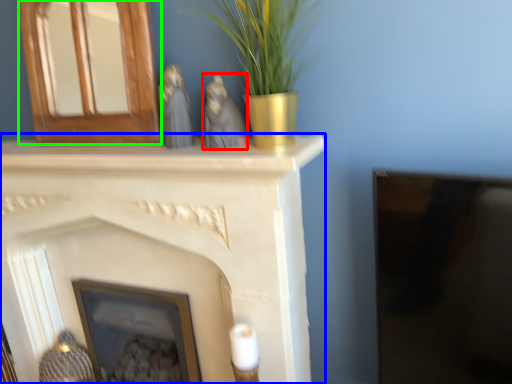
Question: Which object is positioned closest to animal (highlighted by a red box)? Select from fireplace (highlighted by a blue box) and fireplace (highlighted by a green box).

Choices:
 (A) fireplace
 (B) fireplace

Answer: (B)